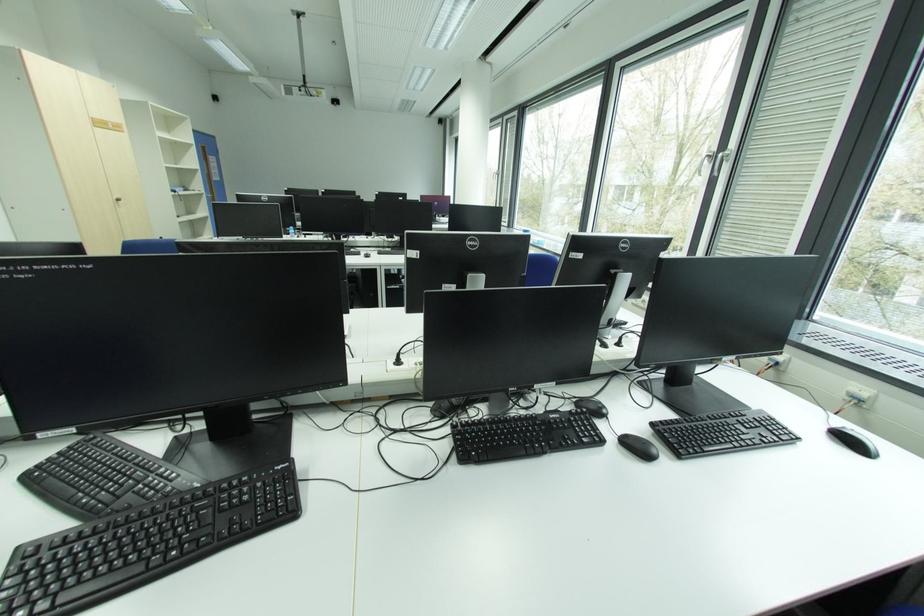
Locate an element on the screen. The image size is (924, 616). cabinet door handle is located at coordinates (117, 199).